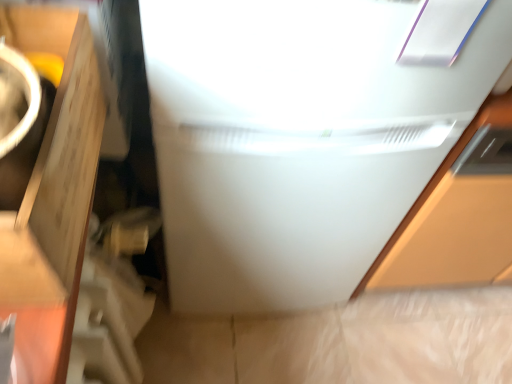
Question: From the image's perspective, is white glossy refrigerator at center above matte brown cardboard at left?

Choices:
 (A) yes
 (B) no

Answer: (A)

Question: From the image's perspective, is white glossy refrigerator at center below matte brown cardboard at left?

Choices:
 (A) no
 (B) yes

Answer: (A)

Question: Is white glossy refrigerator at center facing towards matte brown cardboard at left?

Choices:
 (A) yes
 (B) no

Answer: (B)

Question: Considering the relative sizes of white glossy refrigerator at center and matte brown cardboard at left in the image provided, is white glossy refrigerator at center taller than matte brown cardboard at left?

Choices:
 (A) no
 (B) yes

Answer: (B)

Question: Is white glossy refrigerator at center facing away from matte brown cardboard at left?

Choices:
 (A) no
 (B) yes

Answer: (A)

Question: Would you say white glossy refrigerator at center contains matte brown cardboard at left?

Choices:
 (A) no
 (B) yes

Answer: (A)

Question: Considering the relative sizes of matte brown cardboard at left and white glossy refrigerator at center in the image provided, is matte brown cardboard at left bigger than white glossy refrigerator at center?

Choices:
 (A) yes
 (B) no

Answer: (B)

Question: Considering the relative sizes of matte brown cardboard at left and white glossy refrigerator at center in the image provided, is matte brown cardboard at left wider than white glossy refrigerator at center?

Choices:
 (A) no
 (B) yes

Answer: (A)

Question: Is matte brown cardboard at left next to white glossy refrigerator at center?

Choices:
 (A) yes
 (B) no

Answer: (B)

Question: Considering the relative sizes of matte brown cardboard at left and white glossy refrigerator at center in the image provided, is matte brown cardboard at left thinner than white glossy refrigerator at center?

Choices:
 (A) no
 (B) yes

Answer: (B)

Question: Is matte brown cardboard at left not close to white glossy refrigerator at center?

Choices:
 (A) no
 (B) yes

Answer: (A)

Question: Is matte brown cardboard at left at the left side of white glossy refrigerator at center?

Choices:
 (A) yes
 (B) no

Answer: (A)

Question: Do you think white glossy refrigerator at center is within matte brown cardboard at left, or outside of it?

Choices:
 (A) inside
 (B) outside

Answer: (B)